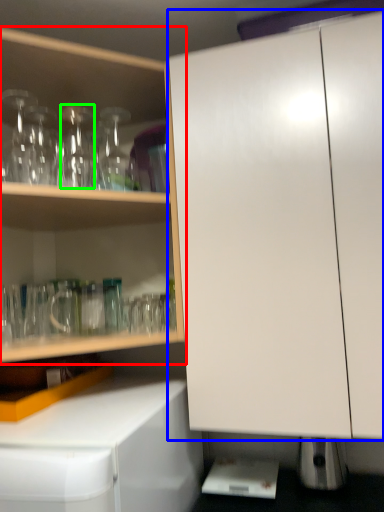
Question: Based on their relative distances, which object is nearer to cabinetry (highlighted by a red box)? Choose from cabinetry (highlighted by a blue box) and bottle (highlighted by a green box).

Choices:
 (A) cabinetry
 (B) bottle

Answer: (B)